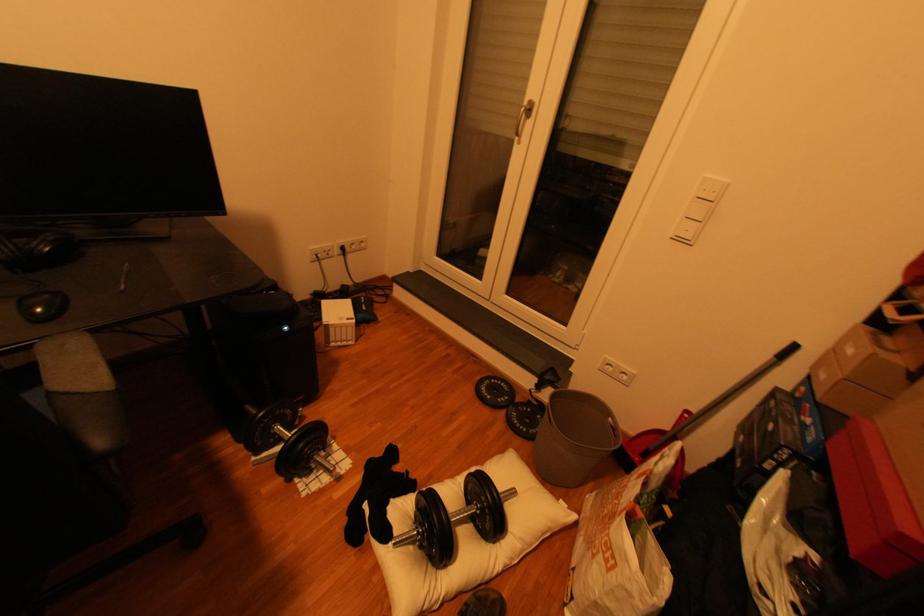
Image resolution: width=924 pixels, height=616 pixels. I want to click on black chair armrest, so click(82, 392).